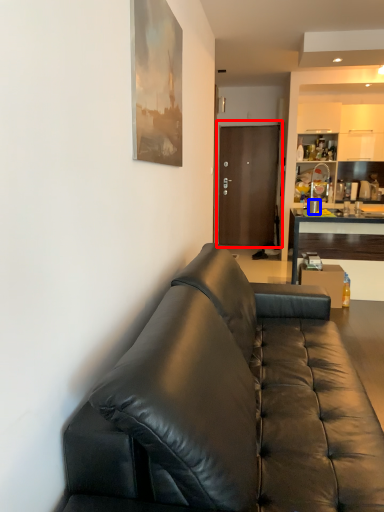
Question: Among these objects, which one is farthest to the camera, door (highlighted by a red box) or coffee cup (highlighted by a blue box)?

Choices:
 (A) door
 (B) coffee cup

Answer: (A)